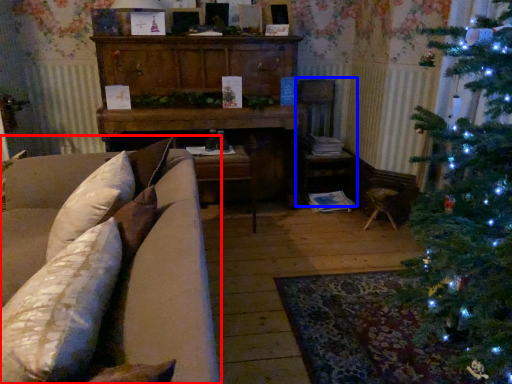
Question: Which of the following is the farthest to the observer, studio couch (highlighted by a red box) or armchair (highlighted by a blue box)?

Choices:
 (A) studio couch
 (B) armchair

Answer: (B)